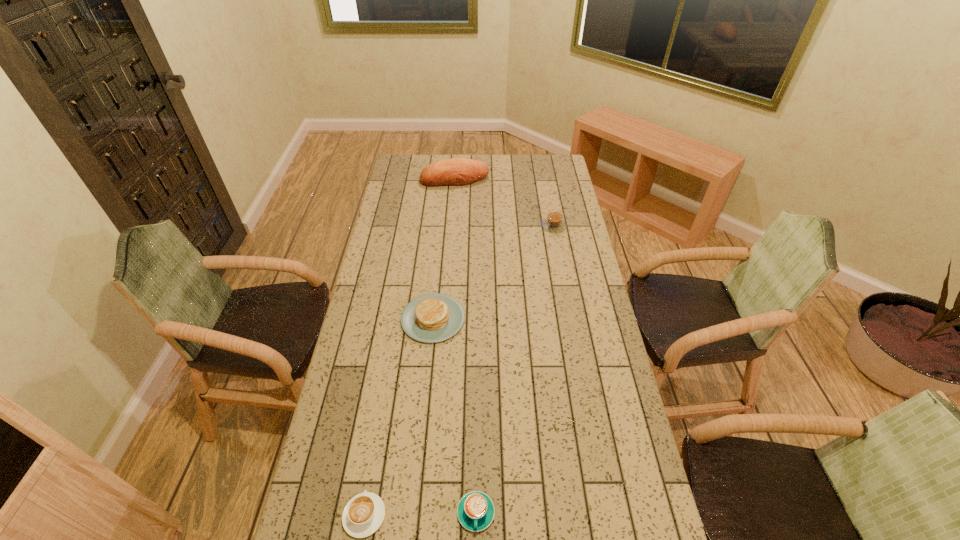
The image size is (960, 540). I want to click on the farthest object, so click(x=458, y=171).

Locate an element on the screen. The image size is (960, 540). the tallest object is located at coordinates (458, 171).

You are a GUI agent. You are given a task and a screenshot of the screen. Output one action in this format:
    pyautogui.click(x=<x>, y=<y>)
    Task: Click on the fourth nearest object
    This screenshot has width=960, height=540.
    Given the screenshot: What is the action you would take?
    pyautogui.click(x=554, y=222)

This screenshot has height=540, width=960. What are the coordinates of `the tallest cappuccino` in the screenshot? It's located at (554, 222).

Where is `pancake`? pancake is located at coordinates (430, 318).

The image size is (960, 540). In order to click on the leftmost cappuccino in this screenshot , I will do `click(364, 513)`.

The image size is (960, 540). Find the location of `the second cappuccino from left to right`. the second cappuccino from left to right is located at coordinates (475, 511).

In order to click on vacant region located on the front of the tallest object in this screenshot , I will do tap(452, 216).

What are the coordinates of `vacant space located on the back of the fourth nearest object` in the screenshot? It's located at (550, 206).

I want to click on vacant area located on the front of the third nearest object, so [x=425, y=396].